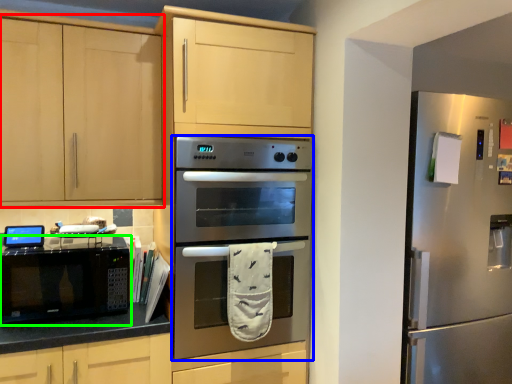
Question: Estimate the real-world distances between objects in this image. Which object is farther from cabinetry (highlighted by a red box), oven (highlighted by a blue box) or microwave oven (highlighted by a green box)?

Choices:
 (A) oven
 (B) microwave oven

Answer: (A)